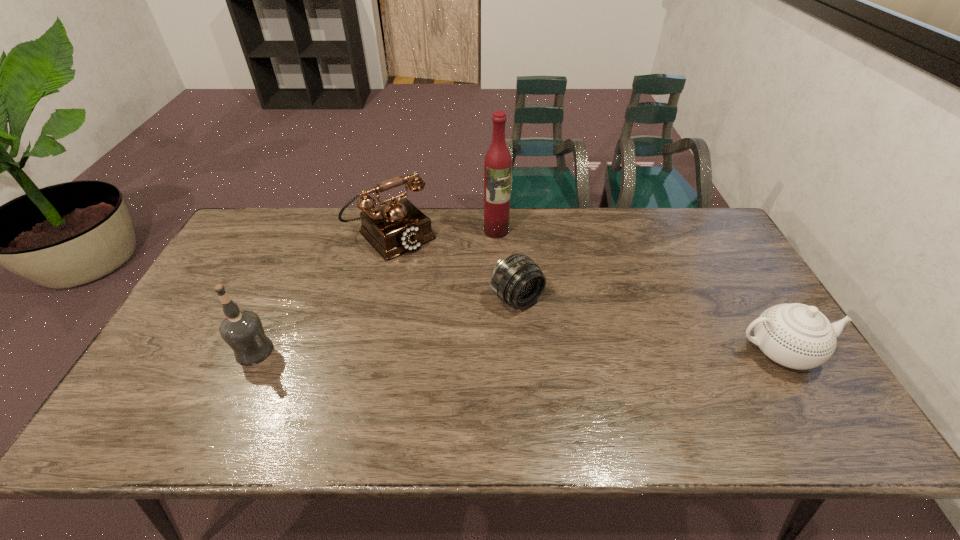
The width and height of the screenshot is (960, 540). I want to click on the leftmost object, so click(x=242, y=330).

This screenshot has height=540, width=960. I want to click on the fourth tallest object, so click(x=798, y=336).

This screenshot has height=540, width=960. In order to click on chinaware in this screenshot , I will do `click(798, 336)`.

Find the location of a particular element. The width and height of the screenshot is (960, 540). the tallest object is located at coordinates (498, 162).

You are a GUI agent. You are given a task and a screenshot of the screen. Output one action in this format:
    pyautogui.click(x=<x>, y=<y>)
    Task: Click on the telephoto lens
    
    Given the screenshot: What is the action you would take?
    pyautogui.click(x=517, y=280)

I want to click on the third nearest object, so click(x=517, y=280).

Find the location of a particular element. The height and width of the screenshot is (540, 960). the fourth object from right to left is located at coordinates coord(396,226).

Identify the location of free spot located 0.070m on the front label of the vodka. The width and height of the screenshot is (960, 540). (209, 351).

Identify the location of free space located on the front label of the vodka. The width and height of the screenshot is (960, 540). (170, 351).

Find the location of a particular element. free location located 0.110m on the front label of the vodka is located at coordinates (193, 351).